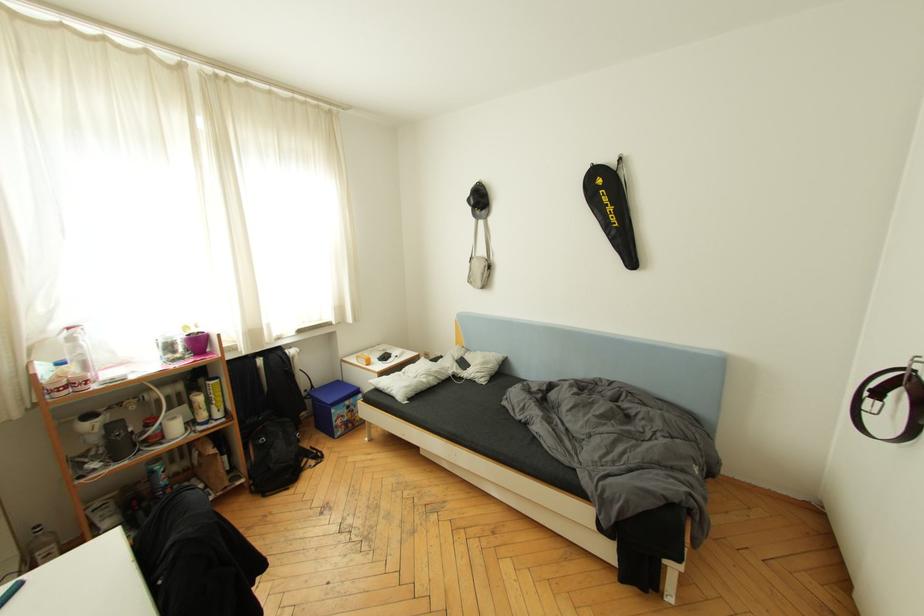
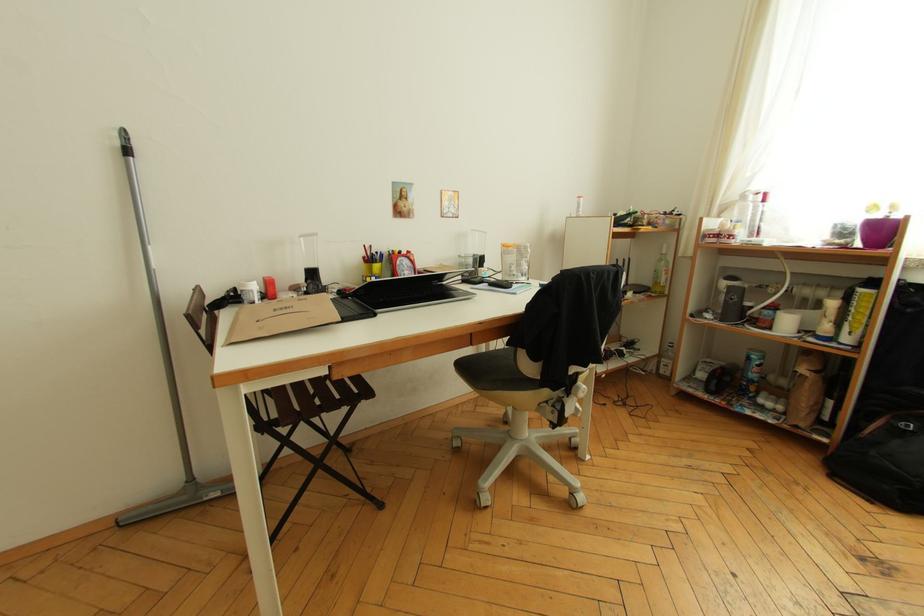
How did the camera likely rotate?

The rotation direction of the camera is left-down.